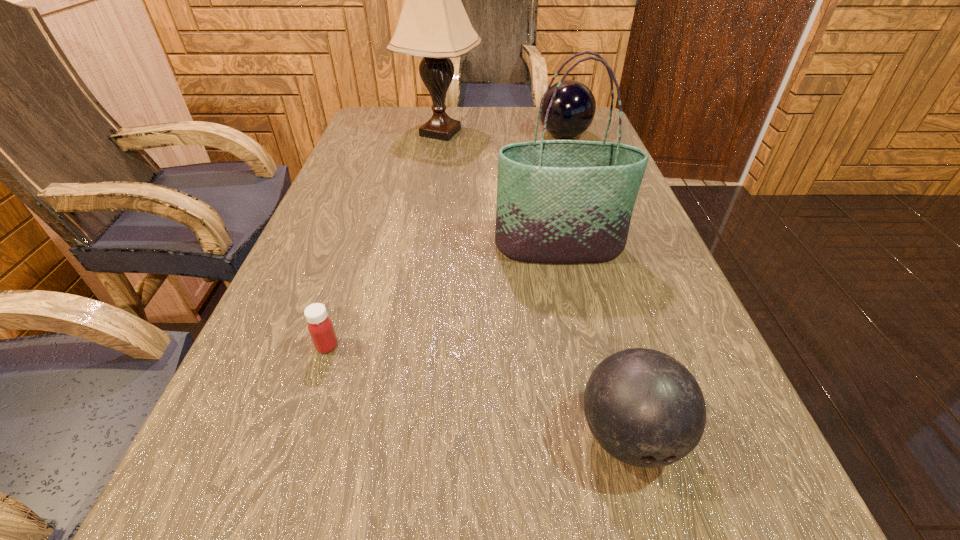
Identify the location of unoccupied position between the nearest object and the tote bag. (594, 342).

Locate an element on the screen. The width and height of the screenshot is (960, 540). blank region between the farther bowling ball and the lamp is located at coordinates (502, 134).

Where is `empty space that is in between the shortest object and the lamp`? Image resolution: width=960 pixels, height=540 pixels. empty space that is in between the shortest object and the lamp is located at coordinates (384, 239).

Identify the location of empty space that is in between the nearer bowling ball and the lamp. (535, 284).

Locate which object ranks in proximity to the lamp. Please provide its 2D coordinates. Your answer should be formatted as a tuple, i.e. [(x, y)], where the tuple contains the x and y coordinates of a point satisfying the conditions above.

[(573, 109)]

Find the location of a particular element. the third closest object to the lamp is located at coordinates (320, 327).

Locate an element on the screen. vacant area that satisfies the following two spatial constraints: 1. on the back side of the second nearest object; 2. on the right side of the lamp is located at coordinates (397, 132).